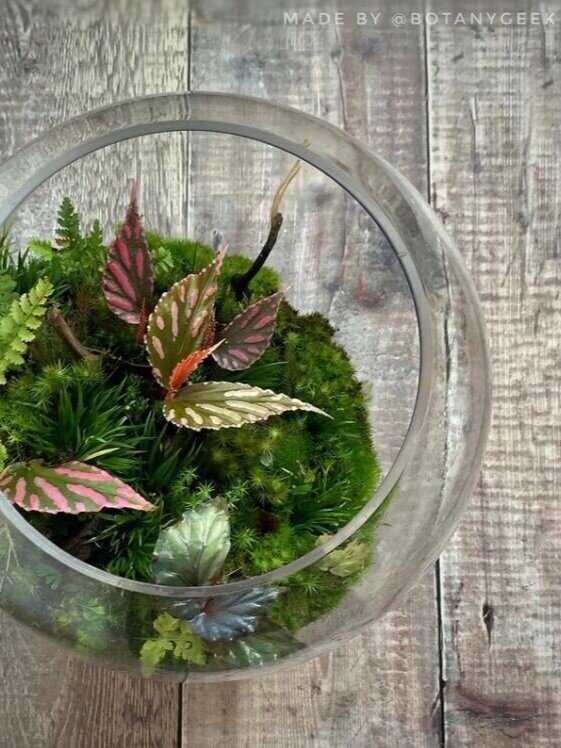
This screenshot has height=748, width=561. Find the location of `terrarium`. terrarium is located at coordinates (436, 496).